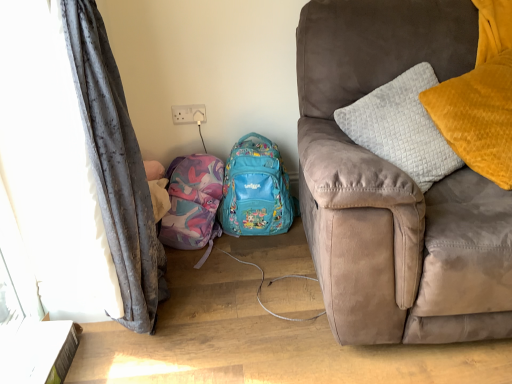
Describe the element at coordinates (481, 99) in the screenshot. I see `velvet yellow pillow at right` at that location.

This screenshot has width=512, height=384. Describe the element at coordinates (193, 203) in the screenshot. I see `matte pink fabric backpack at lower left, which ranks as the first backpack in left-to-right order` at that location.

Locate an element on the screen. This screenshot has width=512, height=384. teal fabric backpack at center, the first backpack positioned from the right is located at coordinates (256, 190).

How much space does teal fabric backpack at center, which is the 2th backpack in left-to-right order, occupy horizontally?

teal fabric backpack at center, which is the 2th backpack in left-to-right order, is 9.76 inches wide.

Find the location of a particular element. This screenshot has width=512, height=384. gray fabric curtain at left is located at coordinates (116, 167).

Where is `curtain that appears in front of the teal fabric backpack at center, which is the 2th backpack in left-to-right order`? This screenshot has width=512, height=384. curtain that appears in front of the teal fabric backpack at center, which is the 2th backpack in left-to-right order is located at coordinates (116, 167).

In the scene shown: Is teal fabric backpack at center, the first backpack positioned from the right, positioned far away from gray fabric curtain at left?

No, teal fabric backpack at center, the first backpack positioned from the right, is not far from gray fabric curtain at left.

Is teal fabric backpack at center, which is the 2th backpack in left-to-right order, positioned with its back to gray fabric curtain at left?

teal fabric backpack at center, which is the 2th backpack in left-to-right order, does not have its back to gray fabric curtain at left.

From the image's perspective, which one is positioned lower, teal fabric backpack at center, which is the 2th backpack in left-to-right order, or gray fabric curtain at left?

gray fabric curtain at left appears lower in the image.

Does point (448, 121) come in front of point (114, 238)?

No.

Find the location of a particular element. This screenshot has height=384, width=512. pillow located above the gray fabric curtain at left (from the image's perspective) is located at coordinates (481, 99).

Relative to gray fabric curtain at left, is velvet yellow pillow at right in front or behind?

velvet yellow pillow at right is positioned farther from the viewer than gray fabric curtain at left.

From a real-world perspective, which object stands above the other?

In real-world perspective, velvet yellow pillow at right is above.

Consider the image. Who is smaller, velvet yellow pillow at right or teal fabric backpack at center, the first backpack positioned from the right?

Smaller between the two is teal fabric backpack at center, the first backpack positioned from the right.

Which point is more distant from viewer, (443, 95) or (269, 202)?

The point (269, 202) is more distant.

Based on the photo, is velvet yellow pillow at right positioned beyond the bounds of teal fabric backpack at center, the first backpack positioned from the right?

Absolutely, velvet yellow pillow at right is external to teal fabric backpack at center, the first backpack positioned from the right.

Based on the photo, is velvet yellow pillow at right shorter than teal fabric backpack at center, which is the 2th backpack in left-to-right order?

Incorrect, the height of velvet yellow pillow at right does not fall short of that of teal fabric backpack at center, which is the 2th backpack in left-to-right order.

Does velvet yellow pillow at right have a larger size compared to matte pink fabric backpack at lower left, placed as the 2th backpack when sorted from right to left?

Indeed, velvet yellow pillow at right has a larger size compared to matte pink fabric backpack at lower left, placed as the 2th backpack when sorted from right to left.

Is there a large distance between velvet yellow pillow at right and matte pink fabric backpack at lower left, which ranks as the first backpack in left-to-right order?

Yes, velvet yellow pillow at right and matte pink fabric backpack at lower left, which ranks as the first backpack in left-to-right order, are quite far apart.

Can you confirm if velvet yellow pillow at right is positioned to the left of matte pink fabric backpack at lower left, placed as the 2th backpack when sorted from right to left?

Incorrect, velvet yellow pillow at right is not on the left side of matte pink fabric backpack at lower left, placed as the 2th backpack when sorted from right to left.

From a real-world perspective, is velvet yellow pillow at right positioned under matte pink fabric backpack at lower left, placed as the 2th backpack when sorted from right to left, based on gravity?

No, from a real-world perspective, velvet yellow pillow at right is not beneath matte pink fabric backpack at lower left, placed as the 2th backpack when sorted from right to left.

Looking at this image, could gray fabric curtain at left be considered to be inside matte pink fabric backpack at lower left, which ranks as the first backpack in left-to-right order?

→ No, gray fabric curtain at left is not inside matte pink fabric backpack at lower left, which ranks as the first backpack in left-to-right order.

From the image's perspective, is matte pink fabric backpack at lower left, placed as the 2th backpack when sorted from right to left, located above or below gray fabric curtain at left?

matte pink fabric backpack at lower left, placed as the 2th backpack when sorted from right to left, is situated higher than gray fabric curtain at left in the image.

Identify the location of the 2nd backpack located beneath the gray fabric curtain at left (from a real-world perspective). 193,203.

Considering the relative sizes of matte pink fabric backpack at lower left, which ranks as the first backpack in left-to-right order, and gray fabric curtain at left in the image provided, is matte pink fabric backpack at lower left, which ranks as the first backpack in left-to-right order, taller than gray fabric curtain at left?

No, matte pink fabric backpack at lower left, which ranks as the first backpack in left-to-right order, is not taller than gray fabric curtain at left.

Which is in front, teal fabric backpack at center, which is the 2th backpack in left-to-right order, or matte pink fabric backpack at lower left, placed as the 2th backpack when sorted from right to left?

teal fabric backpack at center, which is the 2th backpack in left-to-right order, is more forward.

From the picture: Which object is positioned more to the right, teal fabric backpack at center, the first backpack positioned from the right, or matte pink fabric backpack at lower left, which ranks as the first backpack in left-to-right order?

teal fabric backpack at center, the first backpack positioned from the right.

Can you see teal fabric backpack at center, which is the 2th backpack in left-to-right order, touching matte pink fabric backpack at lower left, placed as the 2th backpack when sorted from right to left?

teal fabric backpack at center, which is the 2th backpack in left-to-right order, is not next to matte pink fabric backpack at lower left, placed as the 2th backpack when sorted from right to left, and they're not touching.

Does teal fabric backpack at center, which is the 2th backpack in left-to-right order, have a lesser width compared to matte pink fabric backpack at lower left, placed as the 2th backpack when sorted from right to left?

Yes, teal fabric backpack at center, which is the 2th backpack in left-to-right order, is thinner than matte pink fabric backpack at lower left, placed as the 2th backpack when sorted from right to left.

Can you tell me how much gray fabric curtain at left and suede couch at right differ in facing direction?

89.2 degrees separate the facing orientations of gray fabric curtain at left and suede couch at right.

From a real-world perspective, relative to suede couch at right, is gray fabric curtain at left vertically above or below?

In terms of real-world spatial position, gray fabric curtain at left is above suede couch at right.

Between gray fabric curtain at left and suede couch at right, which one has smaller size?

gray fabric curtain at left is smaller.

Between gray fabric curtain at left and suede couch at right, which one appears on the right side from the viewer's perspective?

From the viewer's perspective, suede couch at right appears more on the right side.

Locate an element on the screen. curtain below the teal fabric backpack at center, which is the 2th backpack in left-to-right order (from the image's perspective) is located at coordinates (116, 167).

Where is `curtain on the left of velvet yellow pillow at right`? This screenshot has height=384, width=512. curtain on the left of velvet yellow pillow at right is located at coordinates (116, 167).

Looking at the image, which one is located further to gray fabric curtain at left, teal fabric backpack at center, which is the 2th backpack in left-to-right order, or velvet yellow pillow at right?

velvet yellow pillow at right is further to gray fabric curtain at left.

Looking at the image, which one is located closer to matte pink fabric backpack at lower left, which ranks as the first backpack in left-to-right order, gray fabric curtain at left or teal fabric backpack at center, which is the 2th backpack in left-to-right order?

teal fabric backpack at center, which is the 2th backpack in left-to-right order, is positioned closer to the anchor matte pink fabric backpack at lower left, which ranks as the first backpack in left-to-right order.

Which object lies further to the anchor point gray fabric curtain at left, matte pink fabric backpack at lower left, which ranks as the first backpack in left-to-right order, or teal fabric backpack at center, the first backpack positioned from the right?

teal fabric backpack at center, the first backpack positioned from the right, is further to gray fabric curtain at left.

From the image, which object appears to be farther from matte pink fabric backpack at lower left, placed as the 2th backpack when sorted from right to left, gray fabric curtain at left or suede couch at right?

suede couch at right lies further to matte pink fabric backpack at lower left, placed as the 2th backpack when sorted from right to left, than the other object.

Considering their positions, is velvet yellow pillow at right positioned closer to teal fabric backpack at center, which is the 2th backpack in left-to-right order, than suede couch at right?

suede couch at right is positioned closer to the anchor teal fabric backpack at center, which is the 2th backpack in left-to-right order.

Considering their positions, is velvet yellow pillow at right positioned closer to teal fabric backpack at center, the first backpack positioned from the right, than matte pink fabric backpack at lower left, which ranks as the first backpack in left-to-right order?

matte pink fabric backpack at lower left, which ranks as the first backpack in left-to-right order, is positioned closer to the anchor teal fabric backpack at center, the first backpack positioned from the right.

From the image, which object appears to be farther from teal fabric backpack at center, which is the 2th backpack in left-to-right order, suede couch at right or velvet yellow pillow at right?

Based on the image, velvet yellow pillow at right appears to be further to teal fabric backpack at center, which is the 2th backpack in left-to-right order.

Which object lies nearer to the anchor point matte pink fabric backpack at lower left, which ranks as the first backpack in left-to-right order, teal fabric backpack at center, the first backpack positioned from the right, or gray fabric curtain at left?

teal fabric backpack at center, the first backpack positioned from the right.

Image resolution: width=512 pixels, height=384 pixels. I want to click on backpack between matte pink fabric backpack at lower left, which ranks as the first backpack in left-to-right order, and velvet yellow pillow at right, so click(256, 190).

Locate an element on the screen. The width and height of the screenshot is (512, 384). backpack between suede couch at right and matte pink fabric backpack at lower left, placed as the 2th backpack when sorted from right to left, from front to back is located at coordinates (256, 190).

What are the coordinates of `studio couch situated between matte pink fabric backpack at lower left, placed as the 2th backpack when sorted from right to left, and velvet yellow pillow at right from left to right` in the screenshot? It's located at (395, 185).

At what (x,y) coordinates should I click in order to perform the action: click on studio couch located between gray fabric curtain at left and teal fabric backpack at center, the first backpack positioned from the right, in the depth direction. Please return your answer as a coordinate pair (x, y). Image resolution: width=512 pixels, height=384 pixels. Looking at the image, I should click on (395, 185).